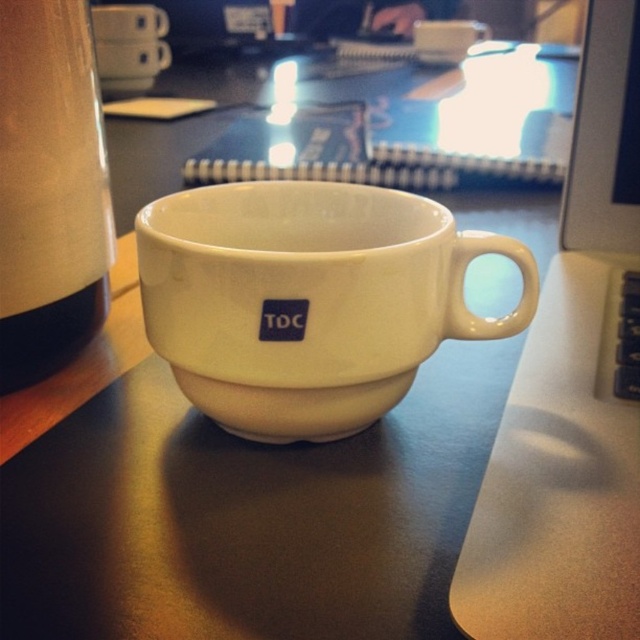
You are a delivery robot positioned at point [109,70]. You need to deliver a package to point [442,298]. The path between these two points is clear except for a white ceramic cup on the desk. Can you navigate around the cup to reach your destination?

Point [442,298] is in front of point [109,70], so the delivery robot can navigate around the white ceramic cup on the desk to reach the destination as long as there is enough space to maneuver around it.

Based on the photo, you are a delivery robot standing 50 centimeters away from the desk. You need to place a package on the desk without touching the white ceramic mug at center. Is the distance sufficient to avoid the mug?

The white ceramic mug at center is 43.34 centimeters away from the viewer. Since the robot is 50 centimeters away, it can place the package on the desk while maintaining a safe distance of approximately 6.66 centimeters from the mug to avoid contact.

You are organizing a tea set on a shelf. You have the white matte mug at upper center and the white matte saucer at upper center. If you want to place them in the correct order as shown in the image, which one should be on the right side?

The white matte mug at upper center should be on the right side because it is positioned to the right of the white matte saucer at upper center in the image.